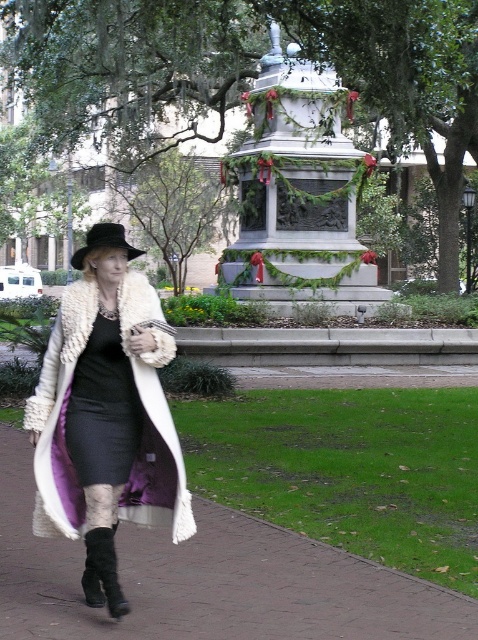
You are a fashion designer observing a woman wearing a black satin dress at center and a black felt fedora at center. You need to design a new outfit that maintains the same color scheme but allows for more movement. Considering the current distance between the dress and hat, would you recommend shortening the dress hemline or adjusting the hat position to achieve this?

The distance between the black satin dress at center and the black felt fedora at center is 34.66 inches. To allow more movement, shortening the dress hemline would be advisable as it maintains the vertical distance while creating a more fluid silhouette without altering the hat position.